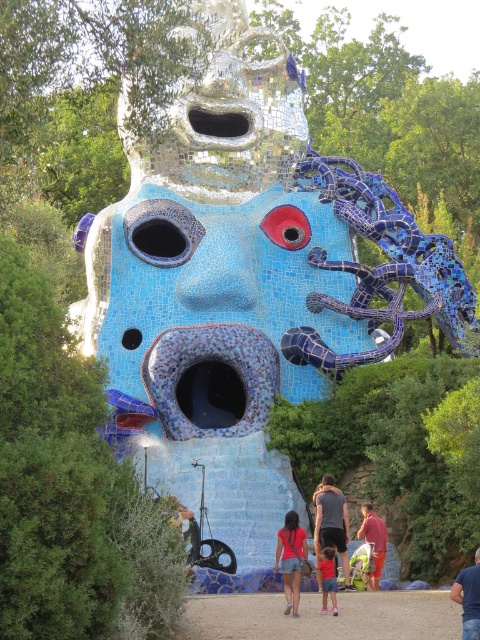
You are an art critic examining the sculpture. You notice the shiny metallic eye at upper center and the matte gray shirt at center. Which object is located to the left of the other?

The shiny metallic eye at upper center is positioned on the left side of matte gray shirt at center.